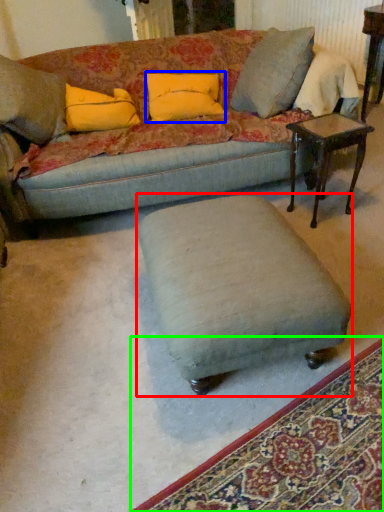
Question: Estimate the real-world distances between objects in this image. Which object is closer to stool (highlighted by a red box), pillow (highlighted by a blue box) or mat (highlighted by a green box)?

Choices:
 (A) pillow
 (B) mat

Answer: (B)